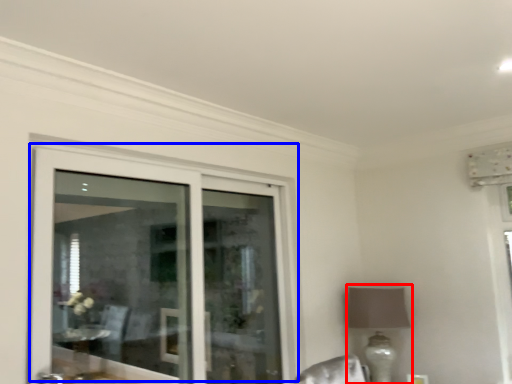
Question: Which point is closer to the camera, table lamp (highlighted by a red box) or door (highlighted by a blue box)?

Choices:
 (A) table lamp
 (B) door

Answer: (B)